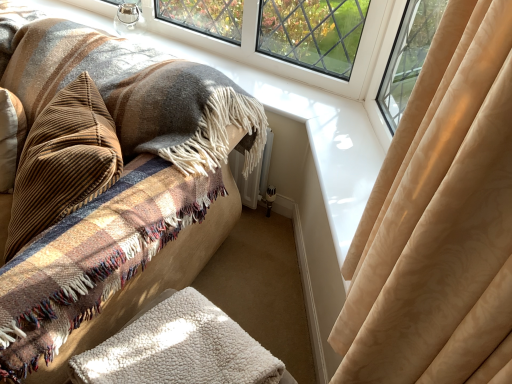
Describe the element at coordinates (101, 169) in the screenshot. I see `plush beige rug at lower center` at that location.

The height and width of the screenshot is (384, 512). What are the coordinates of `brown corduroy pillow at left` in the screenshot? It's located at coord(63,162).

Which object is more forward, plush beige rug at lower center or white fluffy blanket at lower center?

plush beige rug at lower center is in front.

Is white fluffy blanket at lower center inside plush beige rug at lower center?

That's incorrect, white fluffy blanket at lower center is not inside plush beige rug at lower center.

Considering the sizes of objects plush beige rug at lower center and white fluffy blanket at lower center in the image provided, who is smaller, plush beige rug at lower center or white fluffy blanket at lower center?

Smaller between the two is white fluffy blanket at lower center.

Is plush beige rug at lower center far away from white fluffy blanket at lower center?

plush beige rug at lower center is actually quite close to white fluffy blanket at lower center.

Does white fluffy blanket at lower center come behind brown corduroy pillow at left?

No, the depth of white fluffy blanket at lower center is less than that of brown corduroy pillow at left.

Would you say white fluffy blanket at lower center is a long distance from brown corduroy pillow at left?

No.

Where is `throw pillow on the left of the white fluffy blanket at lower center`? throw pillow on the left of the white fluffy blanket at lower center is located at coordinates (63, 162).

Is plush beige rug at lower center thinner than brown corduroy pillow at left?

No.

How many degrees apart are the facing directions of plush beige rug at lower center and brown corduroy pillow at left?

There is a 45-degree angle between the facing directions of plush beige rug at lower center and brown corduroy pillow at left.

From the image's perspective, is plush beige rug at lower center on top of brown corduroy pillow at left?

Yes.

Is point (22, 270) behind point (76, 164)?

That is False.

Identify the location of throw pillow below the plush beige rug at lower center (from the image's perspective). (63, 162).

Is brown corduroy pillow at left to the left of plush beige rug at lower center from the viewer's perspective?

In fact, brown corduroy pillow at left is to the right of plush beige rug at lower center.

In terms of height, does brown corduroy pillow at left look taller or shorter compared to plush beige rug at lower center?

Result: Clearly, brown corduroy pillow at left is shorter compared to plush beige rug at lower center.

From a real-world perspective, is brown corduroy pillow at left beneath plush beige rug at lower center?

No, from a real-world perspective, brown corduroy pillow at left is not beneath plush beige rug at lower center.

Choose the correct answer: Is white fluffy blanket at lower center inside plush beige rug at lower center or outside it?

white fluffy blanket at lower center cannot be found inside plush beige rug at lower center.

Are white fluffy blanket at lower center and plush beige rug at lower center far apart?

No, white fluffy blanket at lower center is not far away from plush beige rug at lower center.

Is white fluffy blanket at lower center looking in the opposite direction of plush beige rug at lower center?

No, white fluffy blanket at lower center is not facing the opposite direction of plush beige rug at lower center.

What's the angular difference between white fluffy blanket at lower center and plush beige rug at lower center's facing directions?

They differ by 8.71 degrees in their facing directions.

Does brown corduroy pillow at left have a lesser height compared to white fluffy blanket at lower center?

No, brown corduroy pillow at left is not shorter than white fluffy blanket at lower center.

Is brown corduroy pillow at left facing away from white fluffy blanket at lower center?

No, brown corduroy pillow at left is not facing the opposite direction of white fluffy blanket at lower center.

In the image, is brown corduroy pillow at left on the left side or the right side of white fluffy blanket at lower center?

From the image, it's evident that brown corduroy pillow at left is to the left of white fluffy blanket at lower center.

Is brown corduroy pillow at left located outside white fluffy blanket at lower center?

Yes, brown corduroy pillow at left is outside of white fluffy blanket at lower center.

Image resolution: width=512 pixels, height=384 pixels. I want to click on furniture in front of the white fluffy blanket at lower center, so click(x=101, y=169).

Locate an element on the screen. The image size is (512, 384). throw pillow above the white fluffy blanket at lower center (from the image's perspective) is located at coordinates (63, 162).

In the scene shown: Which object lies nearer to the anchor point white fluffy blanket at lower center, plush beige rug at lower center or brown corduroy pillow at left?

Among the two, plush beige rug at lower center is located nearer to white fluffy blanket at lower center.

Looking at the image, which one is located further to white fluffy blanket at lower center, brown corduroy pillow at left or plush beige rug at lower center?

The object further to white fluffy blanket at lower center is brown corduroy pillow at left.

Looking at the image, which one is located further to brown corduroy pillow at left, plush beige rug at lower center or white fluffy blanket at lower center?

The object further to brown corduroy pillow at left is white fluffy blanket at lower center.

In the scene shown: From the image, which object appears to be farther from brown corduroy pillow at left, white fluffy blanket at lower center or plush beige rug at lower center?

white fluffy blanket at lower center is positioned further to the anchor brown corduroy pillow at left.

In the scene shown: Looking at the image, which one is located further to plush beige rug at lower center, brown corduroy pillow at left or white fluffy blanket at lower center?

Among the two, white fluffy blanket at lower center is located further to plush beige rug at lower center.

Considering their positions, is white fluffy blanket at lower center positioned further to plush beige rug at lower center than brown corduroy pillow at left?

white fluffy blanket at lower center.

Find the location of a particular element. Image resolution: width=512 pixels, height=384 pixels. throw pillow located between plush beige rug at lower center and white fluffy blanket at lower center in the left-right direction is located at coordinates (63, 162).